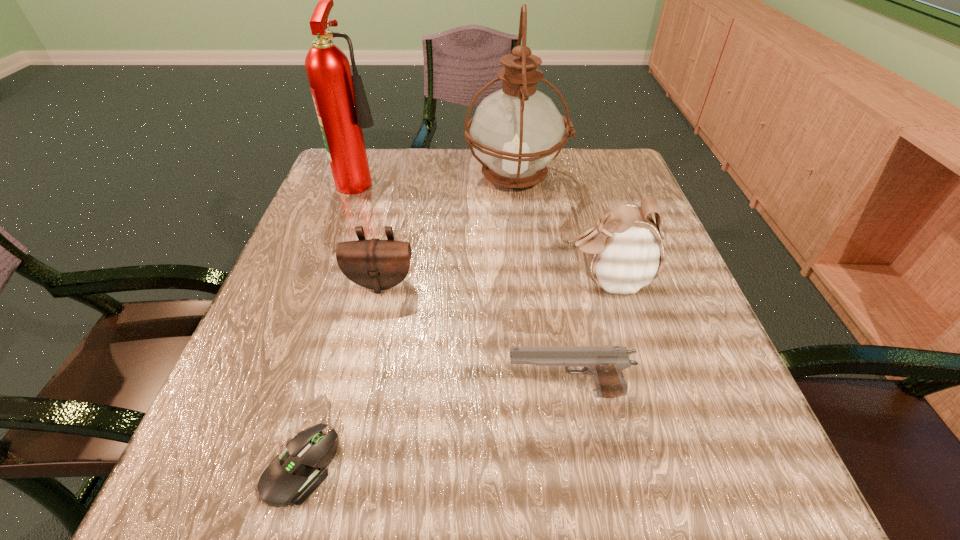
Identify the location of unoccupied area between the oil lamp and the left pouch. (448, 230).

This screenshot has width=960, height=540. Find the location of `empty space that is in between the fire extinguisher and the taller pouch`. empty space that is in between the fire extinguisher and the taller pouch is located at coordinates (485, 230).

Locate an element on the screen. The height and width of the screenshot is (540, 960). empty space that is in between the nearest object and the right pouch is located at coordinates (453, 374).

Locate an element on the screen. vacant space that is in between the nearest object and the third tallest object is located at coordinates (453, 374).

At what (x,y) coordinates should I click in order to perform the action: click on free area in between the fire extinguisher and the shorter pouch. Please return your answer as a coordinate pair (x, y). This screenshot has height=540, width=960. Looking at the image, I should click on (372, 231).

Find the location of a particular element. This screenshot has width=960, height=540. object that stands as the second closest to the left pouch is located at coordinates (605, 364).

Identify the location of object identified as the closest to the fire extinguisher. (517, 131).

Where is `vacant space that satisfies the following two spatial constraints: 1. on the front-facing side of the third tallest object; 2. with the flap open on the left pouch`? Image resolution: width=960 pixels, height=540 pixels. vacant space that satisfies the following two spatial constraints: 1. on the front-facing side of the third tallest object; 2. with the flap open on the left pouch is located at coordinates (607, 283).

This screenshot has height=540, width=960. In order to click on free space that satisfies the following two spatial constraints: 1. on the front-facing side of the taller pouch; 2. with the flap open on the left pouch in this screenshot , I will do `click(607, 283)`.

Where is `vacant space that satisfies the following two spatial constraints: 1. on the front-facing side of the taller pouch; 2. on the front side of the computer mouse`? vacant space that satisfies the following two spatial constraints: 1. on the front-facing side of the taller pouch; 2. on the front side of the computer mouse is located at coordinates (660, 467).